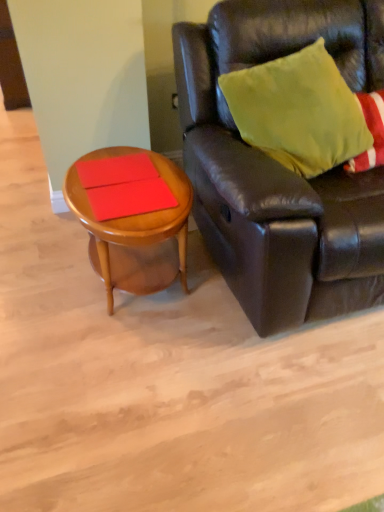
The width and height of the screenshot is (384, 512). In order to click on vacant space that is to the left of woodenobject at left in this screenshot , I will do coord(39,273).